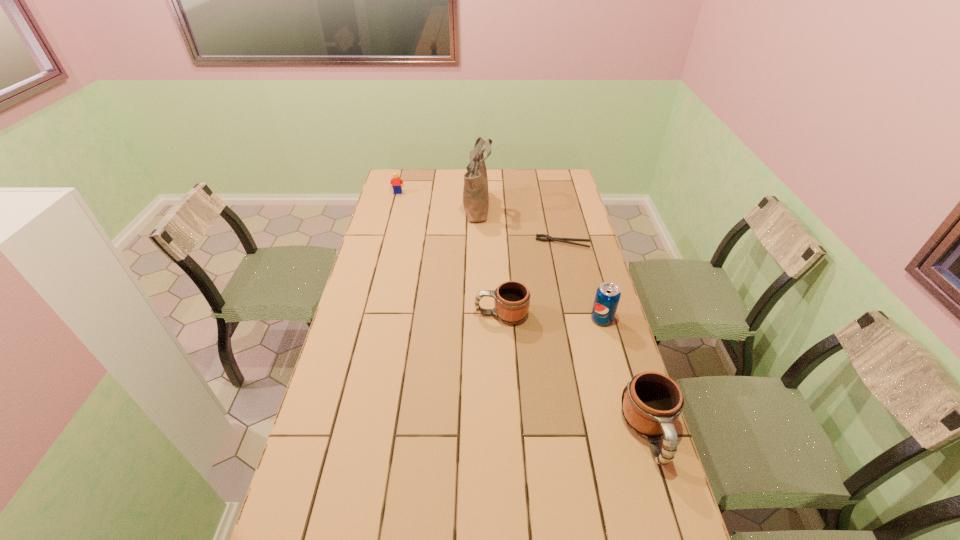
Where is `vacant space that satisfies the following two spatial constraints: 1. on the front side of the pop soda; 2. on the left side of the shortest object`? Image resolution: width=960 pixels, height=540 pixels. vacant space that satisfies the following two spatial constraints: 1. on the front side of the pop soda; 2. on the left side of the shortest object is located at coordinates (581, 319).

Identify the location of vacant space that satisfies the following two spatial constraints: 1. on the front side of the tongs; 2. on the side of the farther mug with the handle. (580, 314).

The height and width of the screenshot is (540, 960). Identify the location of free space that satisfies the following two spatial constraints: 1. on the face of the tongs; 2. on the left side of the leftmost object. (385, 244).

I want to click on free space in the image that satisfies the following two spatial constraints: 1. on the face of the pop soda; 2. on the left side of the Lego, so click(x=365, y=319).

Identify the location of free region that satisfies the following two spatial constraints: 1. on the side of the shorter mug with the handle; 2. on the left side of the pop soda. (502, 319).